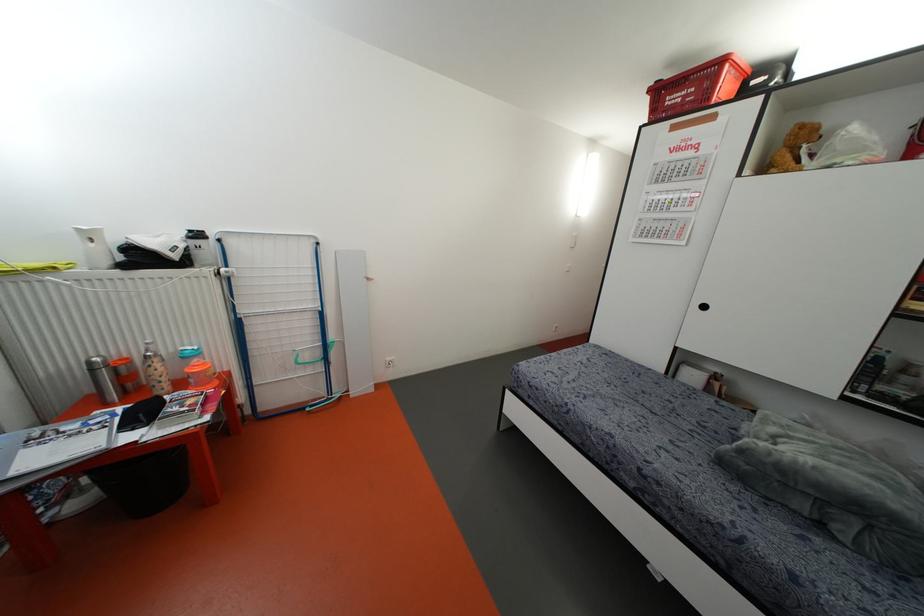
Where is `black trash bin`? black trash bin is located at coordinates (143, 483).